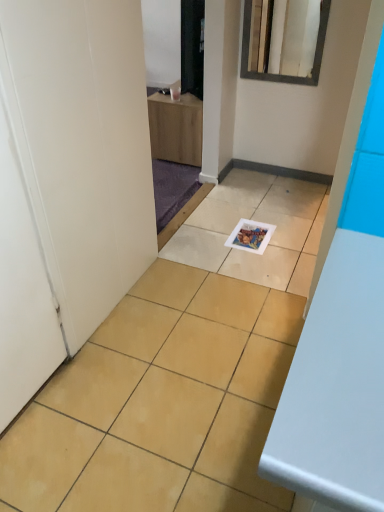
Question: Is white glossy mirror at upper center located outside matte paper magazine at center?

Choices:
 (A) no
 (B) yes

Answer: (B)

Question: Is white glossy mirror at upper center far away from matte paper magazine at center?

Choices:
 (A) yes
 (B) no

Answer: (B)

Question: Is white glossy mirror at upper center to the right of matte paper magazine at center from the viewer's perspective?

Choices:
 (A) no
 (B) yes

Answer: (B)

Question: Is white glossy mirror at upper center placed right next to matte paper magazine at center?

Choices:
 (A) yes
 (B) no

Answer: (B)

Question: From the image's perspective, is white glossy mirror at upper center located beneath matte paper magazine at center?

Choices:
 (A) yes
 (B) no

Answer: (B)

Question: Is white glossy mirror at upper center turned away from matte paper magazine at center?

Choices:
 (A) yes
 (B) no

Answer: (B)

Question: Is matte paper magazine at center surrounding white glossy mirror at upper center?

Choices:
 (A) yes
 (B) no

Answer: (B)

Question: Is matte paper magazine at center at the right side of white glossy mirror at upper center?

Choices:
 (A) yes
 (B) no

Answer: (B)

Question: From a real-world perspective, is matte paper magazine at center beneath white glossy mirror at upper center?

Choices:
 (A) no
 (B) yes

Answer: (B)

Question: Are matte paper magazine at center and white glossy mirror at upper center located far from each other?

Choices:
 (A) yes
 (B) no

Answer: (B)

Question: Is matte paper magazine at center in front of white glossy mirror at upper center?

Choices:
 (A) no
 (B) yes

Answer: (B)

Question: From the image's perspective, is matte paper magazine at center located above white glossy mirror at upper center?

Choices:
 (A) no
 (B) yes

Answer: (A)

Question: Is matte paper magazine at center at the right side of white matte door at left?

Choices:
 (A) yes
 (B) no

Answer: (A)